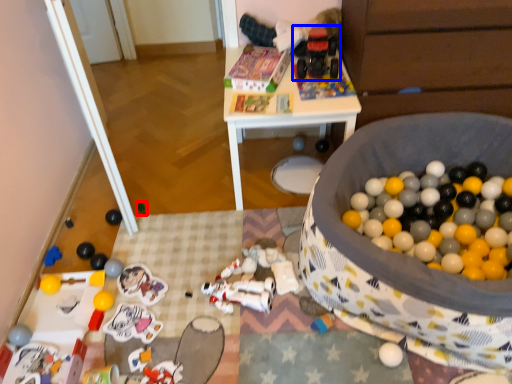
Question: Among these objects, which one is farthest to the camera, toy (highlighted by a red box) or toy (highlighted by a blue box)?

Choices:
 (A) toy
 (B) toy

Answer: (A)